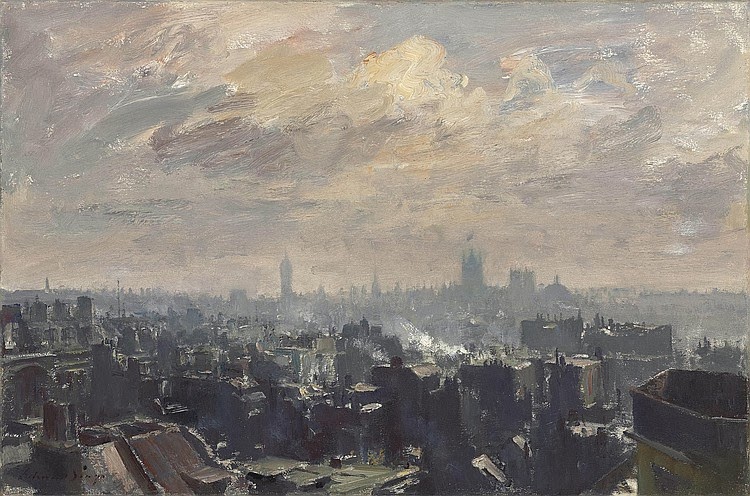
I want to click on art work, so click(522, 364).